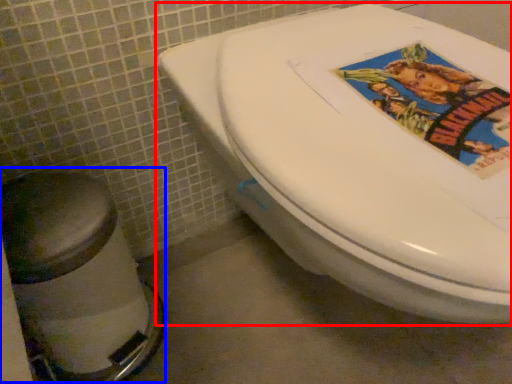
Question: Which of the following is the farthest to the observer, toilet (highlighted by a red box) or bidet (highlighted by a blue box)?

Choices:
 (A) toilet
 (B) bidet

Answer: (B)